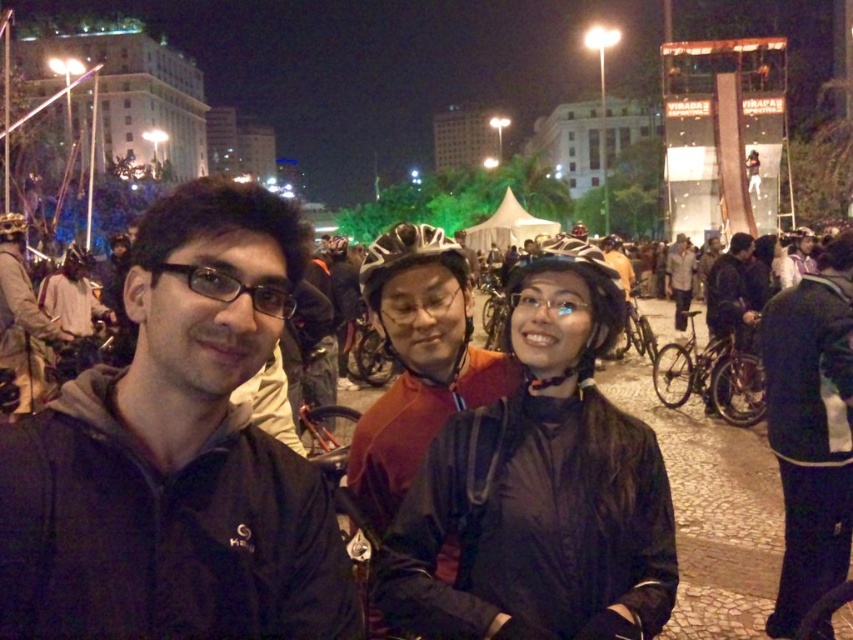
You are a photographer standing at the camera position. You want to capture a closeup shot of the black matte helmet at center. Given that your telephoto lens can focus on objects within 30 meters, will you be able to take the photo without moving closer?

The black matte helmet at center is 33.23 meters from the camera, which is beyond the telephoto lens focus range of 30 meters. Therefore, you cannot take the closeup shot without moving closer.

You are organizing a group photo for cyclists at a nighttime event. The cyclists are wearing a matte red jacket at center and a dark blue jacket at center. To ensure both jackets are clearly visible in the photo, which jacket should be placed closer to the camera to compensate for its size?

The dark blue jacket at center should be placed closer to the camera because it is smaller in size than the matte red jacket at center, making it appear more prominent in the photo.